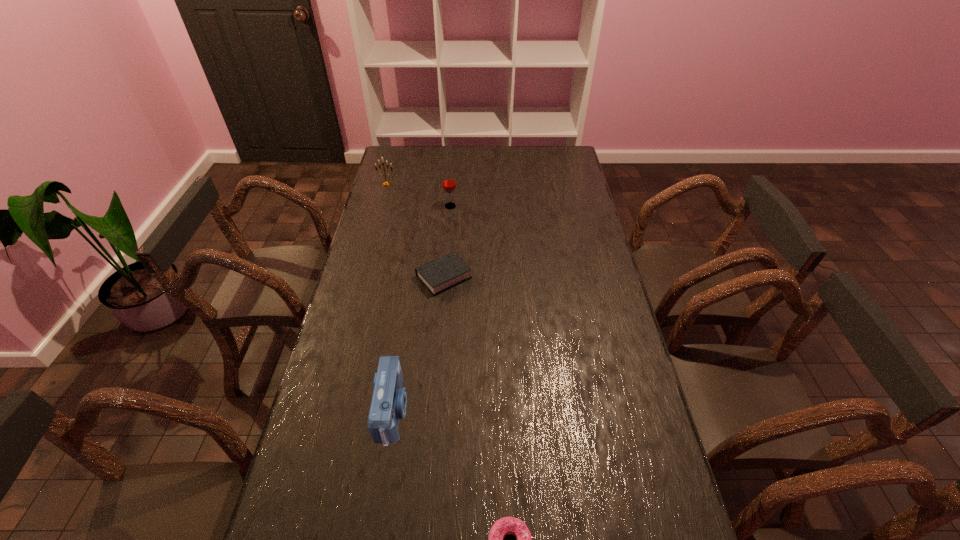
The width and height of the screenshot is (960, 540). In order to click on vacant region at the far edge of the desktop in this screenshot , I will do `click(505, 166)`.

What are the coordinates of `free point at the left edge` in the screenshot? It's located at (385, 258).

You are a GUI agent. You are given a task and a screenshot of the screen. Output one action in this format:
    pyautogui.click(x=<x>, y=<y>)
    Task: Click on the free space at the right edge of the desktop
    
    Given the screenshot: What is the action you would take?
    pyautogui.click(x=614, y=435)

Where is `empty space between the second nearest object and the leftmost object`? The height and width of the screenshot is (540, 960). empty space between the second nearest object and the leftmost object is located at coordinates (390, 298).

Where is `free space between the camera and the fourth nearest object`? free space between the camera and the fourth nearest object is located at coordinates (421, 308).

Where is `free spot between the third farthest object and the fourth nearest object`? free spot between the third farthest object and the fourth nearest object is located at coordinates (447, 241).

Where is `the closest object relative to the rightmost object`? The width and height of the screenshot is (960, 540). the closest object relative to the rightmost object is located at coordinates (389, 400).

I want to click on object that can be found as the second closest to the candelabrum, so click(x=438, y=275).

Locate an element on the screen. This screenshot has height=540, width=960. vacant space that satisfies the following two spatial constraints: 1. on the front side of the fourth nearest object; 2. on the lens of the fourth farthest object is located at coordinates (434, 411).